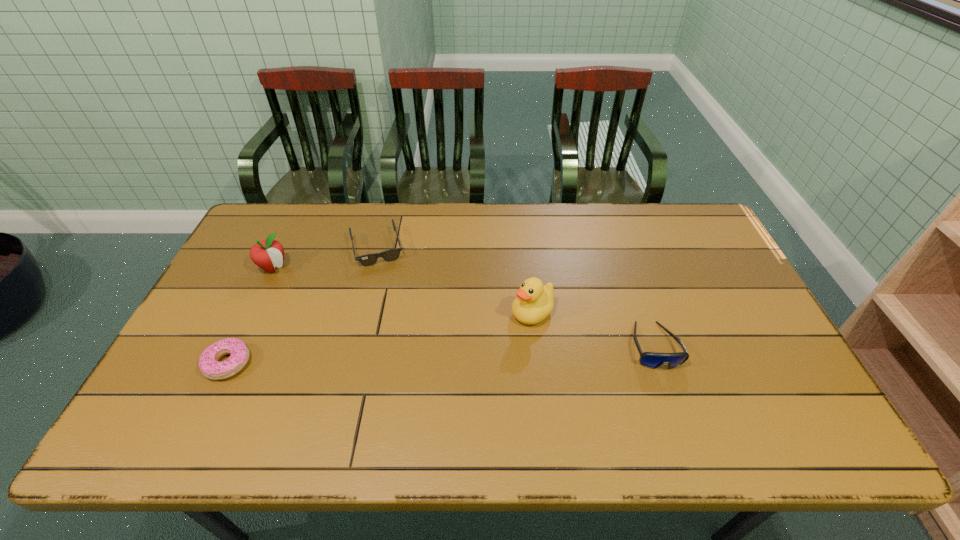
Where is `unoccupied area between the doughnut and the taller sunglasses`? unoccupied area between the doughnut and the taller sunglasses is located at coordinates 441,354.

You are a GUI agent. You are given a task and a screenshot of the screen. Output one action in this format:
    pyautogui.click(x=<x>, y=<y>)
    Task: Click on the free space between the apple and the nearer sunglasses
    The height and width of the screenshot is (540, 960).
    Given the screenshot: What is the action you would take?
    pyautogui.click(x=464, y=306)

Identify the location of vacant region between the third object from left to right and the apple. Image resolution: width=960 pixels, height=540 pixels. (325, 258).

Locate an element on the screen. This screenshot has height=540, width=960. free space between the doughnut and the right sunglasses is located at coordinates (441, 354).

You are a GUI agent. You are given a task and a screenshot of the screen. Output one action in this format:
    pyautogui.click(x=<x>, y=<y>)
    Task: Click on the empty space between the farther sunglasses and the doughnut
    The image size is (960, 540).
    Given the screenshot: What is the action you would take?
    pyautogui.click(x=302, y=306)

The width and height of the screenshot is (960, 540). Identify the location of vacant space in between the doughnut and the second tallest object. (251, 315).

Identify the location of free spot between the tallest object and the doughnut. (380, 338).

This screenshot has width=960, height=540. I want to click on free space between the fourth shortest object and the tallest object, so click(x=403, y=290).

Identify the location of object that is the fourth closest to the farther sunglasses. The width and height of the screenshot is (960, 540). (653, 360).

Choose which object is the second nearest neighbor to the doughnut. Please provide its 2D coordinates. Your answer should be formatted as a tuple, i.e. [(x, y)], where the tuple contains the x and y coordinates of a point satisfying the conditions above.

[(389, 255)]